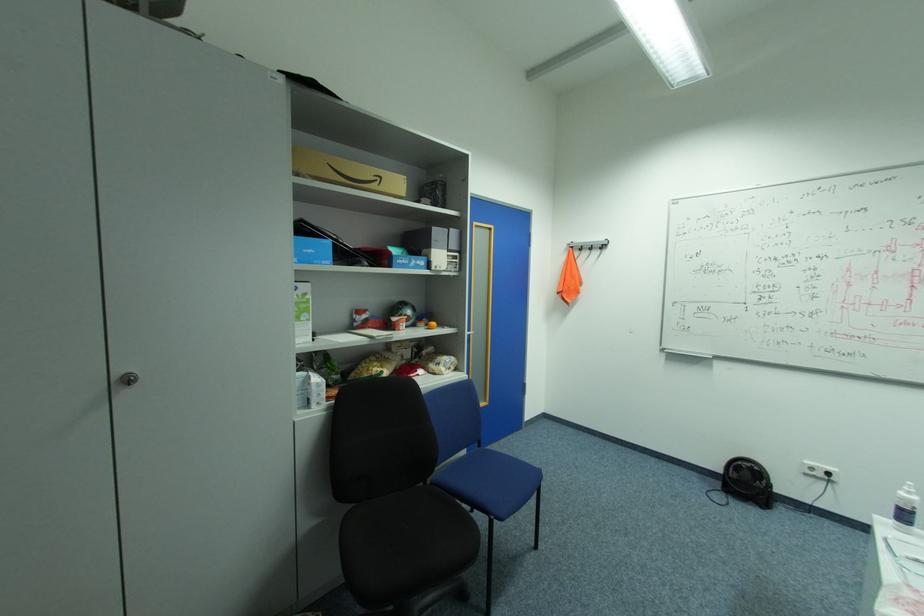
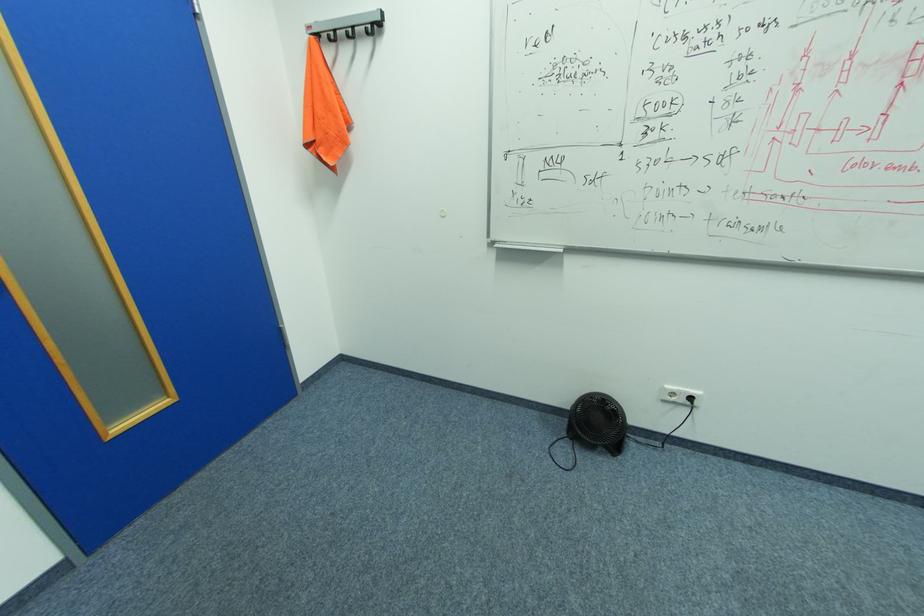
In the second image, find the point that corresponds to point 609,245 in the first image.

(379, 23)